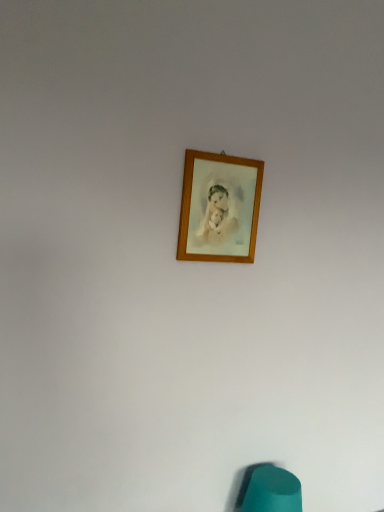
Question: Relative to teal fabric bean bag chair at lower center, is wooden picture frame at upper center in front or behind?

Choices:
 (A) behind
 (B) front

Answer: (B)

Question: In terms of size, does wooden picture frame at upper center appear bigger or smaller than teal fabric bean bag chair at lower center?

Choices:
 (A) big
 (B) small

Answer: (B)

Question: Is wooden picture frame at upper center wider or thinner than teal fabric bean bag chair at lower center?

Choices:
 (A) wide
 (B) thin

Answer: (B)

Question: Considering the positions of teal fabric bean bag chair at lower center and wooden picture frame at upper center in the image, is teal fabric bean bag chair at lower center wider or thinner than wooden picture frame at upper center?

Choices:
 (A) wide
 (B) thin

Answer: (A)

Question: In terms of size, does teal fabric bean bag chair at lower center appear bigger or smaller than wooden picture frame at upper center?

Choices:
 (A) big
 (B) small

Answer: (A)

Question: Relative to wooden picture frame at upper center, is teal fabric bean bag chair at lower center in front or behind?

Choices:
 (A) behind
 (B) front

Answer: (A)

Question: Does point (294, 477) appear closer or farther from the camera than point (213, 214)?

Choices:
 (A) closer
 (B) farther

Answer: (B)